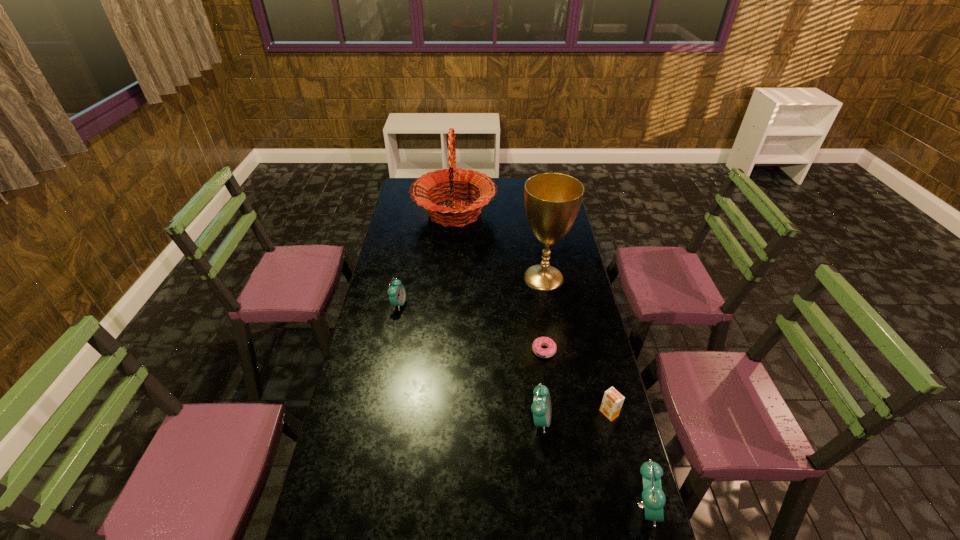
You are a GUI agent. You are given a task and a screenshot of the screen. Output one action in this format:
    pyautogui.click(x=<x>, y=<y>)
    Task: Click on the basket present at the left edge
    The height and width of the screenshot is (540, 960).
    Given the screenshot: What is the action you would take?
    pyautogui.click(x=474, y=181)

What are the coordinates of `alarm clock that is at the right edge` in the screenshot? It's located at (653, 497).

The image size is (960, 540). I want to click on trophy cup at the right edge, so click(552, 200).

Locate an element on the screen. The height and width of the screenshot is (540, 960). orange juice that is at the right edge is located at coordinates click(612, 402).

Identify the location of object that is at the far left corner. The image size is (960, 540). (474, 181).

I want to click on object that is at the near right corner, so click(653, 497).

You are a GUI agent. You are given a task and a screenshot of the screen. Output one action in this format:
    pyautogui.click(x=<x>, y=<y>)
    Task: Click on the free point at the far edge
    The width and height of the screenshot is (960, 540).
    Given the screenshot: What is the action you would take?
    pyautogui.click(x=515, y=197)

Identify the location of vacant region at the left edge. The height and width of the screenshot is (540, 960). (372, 345).

Where is `vacant space at the right edge`? vacant space at the right edge is located at coordinates (571, 308).

Locate an element on the screen. This screenshot has width=960, height=540. unoccupied position between the second farthest alarm clock and the orange juice is located at coordinates (574, 416).